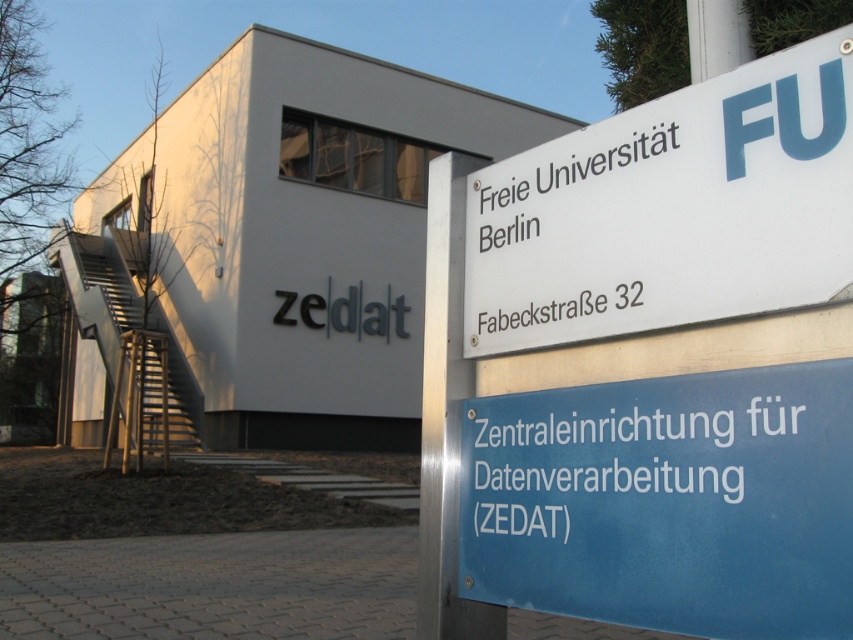
In the scene shown: Between blue glossy sign at center and white plastic sign at upper right, which one has less height?

blue glossy sign at center is shorter.

Does point (602, 572) come behind point (555, 212)?

No, it is not.

Which is in front, point (550, 464) or point (675, 275)?

Point (675, 275) is more forward.

You are a GUI agent. You are given a task and a screenshot of the screen. Output one action in this format:
    pyautogui.click(x=<x>, y=<y>)
    Task: Click on the blue glossy sign at center
    The height and width of the screenshot is (640, 853).
    Given the screenshot: What is the action you would take?
    pyautogui.click(x=666, y=500)